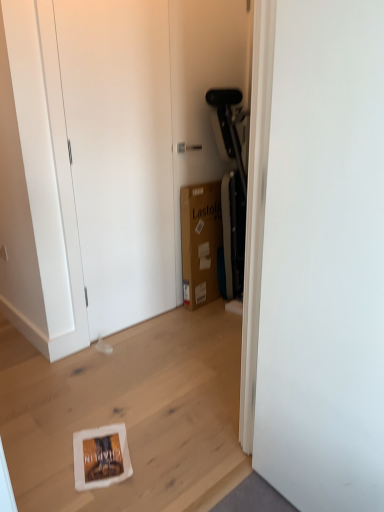
Question: Can you confirm if white matte door at center, acting as the 1th door starting from the right, is wider than brown cardboard box at center?

Choices:
 (A) yes
 (B) no

Answer: (B)

Question: Is white matte door at center, acting as the 1th door starting from the right, positioned with its back to brown cardboard box at center?

Choices:
 (A) no
 (B) yes

Answer: (A)

Question: Could brown cardboard box at center be considered to be inside white matte door at center, which appears as the 2th door when viewed from the back?

Choices:
 (A) no
 (B) yes

Answer: (A)

Question: From the image's perspective, is white matte door at center, marked as the 1th door in a front-to-back arrangement, under brown cardboard box at center?

Choices:
 (A) yes
 (B) no

Answer: (A)

Question: Is white matte door at center, positioned as the 2th door in left-to-right order, bigger than brown cardboard box at center?

Choices:
 (A) no
 (B) yes

Answer: (B)

Question: Do you think brown cardboard box at center is within matte white dresser at center, or outside of it?

Choices:
 (A) outside
 (B) inside

Answer: (A)

Question: Based on their positions, is brown cardboard box at center located to the left or right of matte white dresser at center?

Choices:
 (A) left
 (B) right

Answer: (B)

Question: In terms of width, does brown cardboard box at center look wider or thinner when compared to matte white dresser at center?

Choices:
 (A) thin
 (B) wide

Answer: (B)

Question: Is point (210, 293) closer or farther from the camera than point (82, 48)?

Choices:
 (A) closer
 (B) farther

Answer: (B)

Question: From their relative heights in the image, would you say white matte door at upper left, arranged as the 2th door when viewed from the right, is taller or shorter than white matte door at center, acting as the 1th door starting from the right?

Choices:
 (A) short
 (B) tall

Answer: (B)

Question: From a real-world perspective, is white matte door at upper left, the first door viewed from the left, positioned above or below white matte door at center, marked as the 1th door in a front-to-back arrangement?

Choices:
 (A) above
 (B) below

Answer: (A)

Question: Looking at their shapes, would you say white matte door at upper left, arranged as the 2th door when viewed from the right, is wider or thinner than white matte door at center, acting as the 1th door starting from the right?

Choices:
 (A) thin
 (B) wide

Answer: (A)

Question: From the image's perspective, is white matte door at upper left, arranged as the second door when viewed from the front, positioned above or below white matte door at center, acting as the 1th door starting from the right?

Choices:
 (A) below
 (B) above

Answer: (B)

Question: Is brown cardboard box at center in front of or behind white matte door at center, acting as the 1th door starting from the right, in the image?

Choices:
 (A) front
 (B) behind

Answer: (B)

Question: Based on their sizes in the image, would you say brown cardboard box at center is bigger or smaller than white matte door at center, which appears as the 2th door when viewed from the back?

Choices:
 (A) big
 (B) small

Answer: (B)